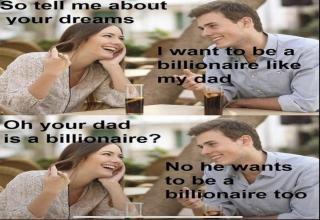
At what (x,y) coordinates should I click in order to perform the action: click on cup. Please return your answer as a coordinate pair (x, y). The height and width of the screenshot is (220, 320). Looking at the image, I should click on (134, 208), (136, 89), (212, 89).